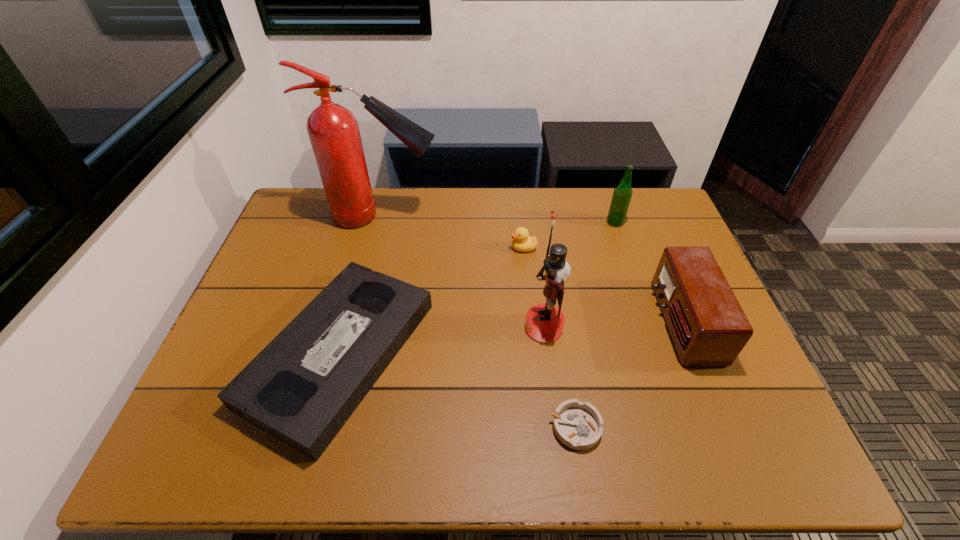
Locate an element on the screen. The image size is (960, 540). fire extinguisher is located at coordinates (333, 130).

Locate an element on the screen. The image size is (960, 540). nutcracker is located at coordinates (544, 322).

Find the location of a particular element. beer bottle is located at coordinates (622, 194).

Where is `radio receiver`? This screenshot has height=540, width=960. radio receiver is located at coordinates (708, 326).

The width and height of the screenshot is (960, 540). I want to click on the third farthest object, so click(x=522, y=242).

You are a GUI agent. You are given a task and a screenshot of the screen. Output one action in this format:
    pyautogui.click(x=<x>, y=<y>)
    Task: Click on the fifth tallest object
    This screenshot has height=540, width=960.
    Given the screenshot: What is the action you would take?
    pyautogui.click(x=522, y=242)

Locate an element on the screen. videotape is located at coordinates (302, 388).

Locate an element on the screen. the shortest object is located at coordinates (578, 425).

Identify the location of vacant region located at the nozzle end of the tallest object. (494, 217).

Where is `free location located 0.180m on the front-facing side of the nutcracker`? This screenshot has height=540, width=960. free location located 0.180m on the front-facing side of the nutcracker is located at coordinates (457, 327).